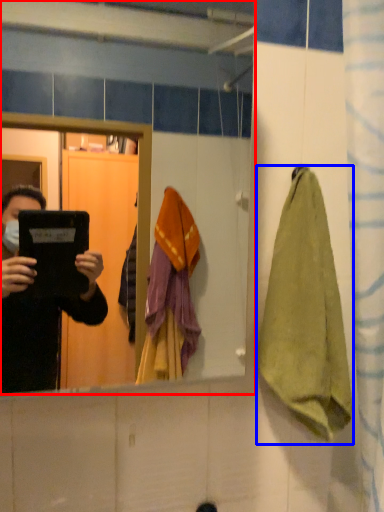
Question: Which point is closer to the camera, mirror (highlighted by a red box) or towel/napkin (highlighted by a blue box)?

Choices:
 (A) mirror
 (B) towel/napkin

Answer: (A)